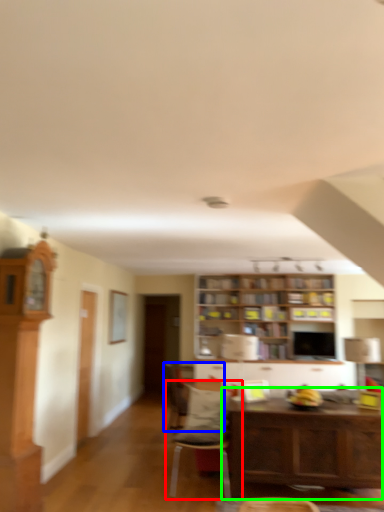
Question: Which object is positioned farthest from chair (highlighted by a red box)? Select from chair (highlighted by a blue box) and table (highlighted by a green box).

Choices:
 (A) chair
 (B) table

Answer: (B)